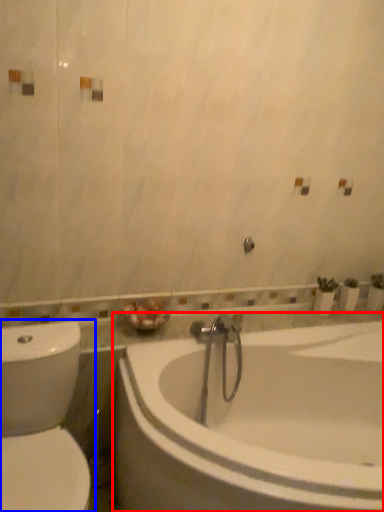
Question: Among these objects, which one is farthest to the camera, bathtub (highlighted by a red box) or toilet (highlighted by a blue box)?

Choices:
 (A) bathtub
 (B) toilet

Answer: (B)